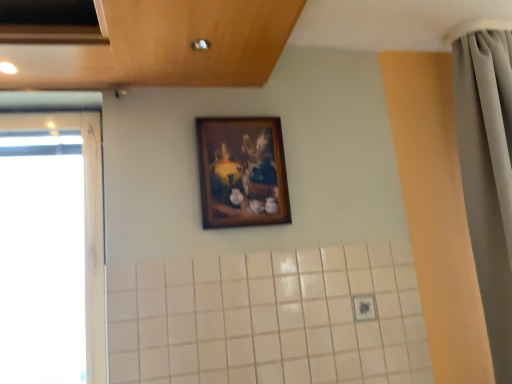
Question: Considering the positions of point (92, 251) and point (455, 92), is point (92, 251) closer or farther from the camera than point (455, 92)?

Choices:
 (A) closer
 (B) farther

Answer: (A)

Question: From a real-world perspective, relative to gray fabric shower curtain at right, is transparent glass window at left vertically above or below?

Choices:
 (A) above
 (B) below

Answer: (B)

Question: Which of these objects is positioned closest to the gray fabric shower curtain at right?

Choices:
 (A) transparent glass window at left
 (B) wooden frame at upper center

Answer: (B)

Question: Which object is the farthest from the wooden frame at upper center?

Choices:
 (A) gray fabric shower curtain at right
 (B) transparent glass window at left

Answer: (A)